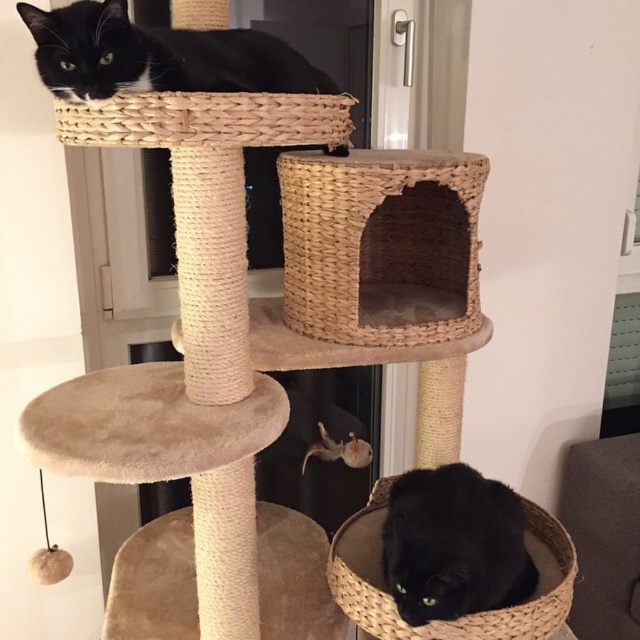
Is black matte cat at upper center positioned in front of woven straw basket at upper center?

That is True.

Can you confirm if black matte cat at upper center is positioned below woven straw basket at upper center?

Actually, black matte cat at upper center is above woven straw basket at upper center.

Is point (48, 17) farther from viewer compared to point (272, 97)?

No.

This screenshot has height=640, width=640. Identify the location of black matte cat at upper center. (157, 54).

Which is in front, point (266, 52) or point (508, 493)?

Point (266, 52)

Which is above, black matte cat at upper center or black matte cat at lower center?

black matte cat at upper center is above.

Find the location of a particular element. The height and width of the screenshot is (640, 640). black matte cat at upper center is located at coordinates (157, 54).

In order to click on black matte cat at upper center in this screenshot , I will do `click(157, 54)`.

In the scene shown: Can you confirm if beige plush stool at center is taller than black matte cat at lower center?

No.

What do you see at coordinates (145, 426) in the screenshot? I see `beige plush stool at center` at bounding box center [145, 426].

Is point (86, 472) farther from viewer compared to point (438, 468)?

No, (86, 472) is closer to viewer.

I want to click on beige plush stool at center, so click(x=145, y=426).